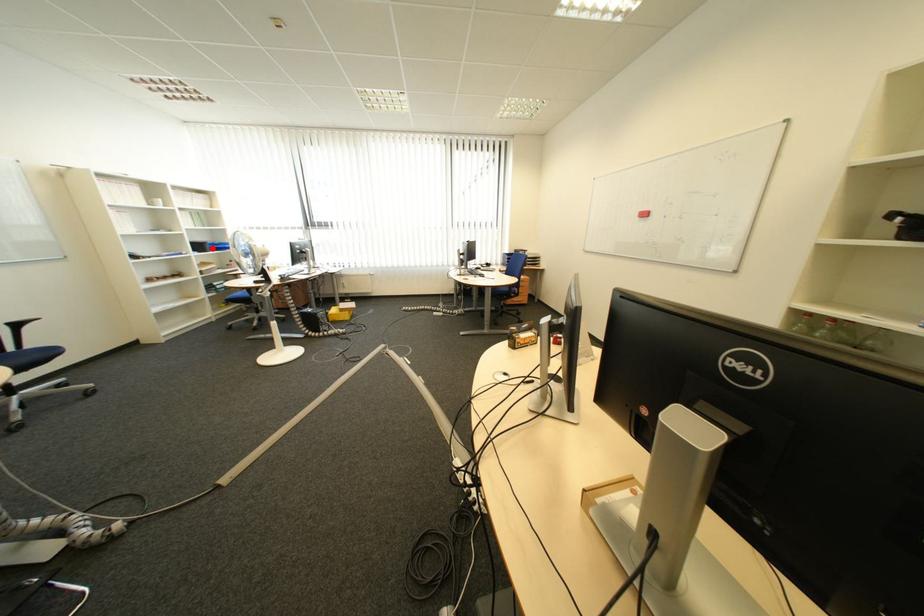
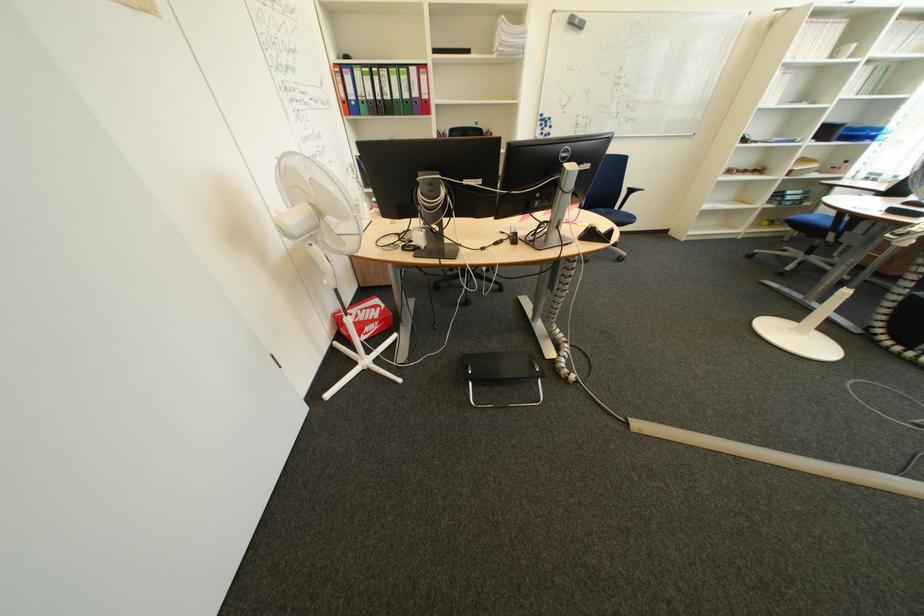
The point at the highlighted location is marked in the first image. Where is the corresponding point in the second image?

(840, 132)